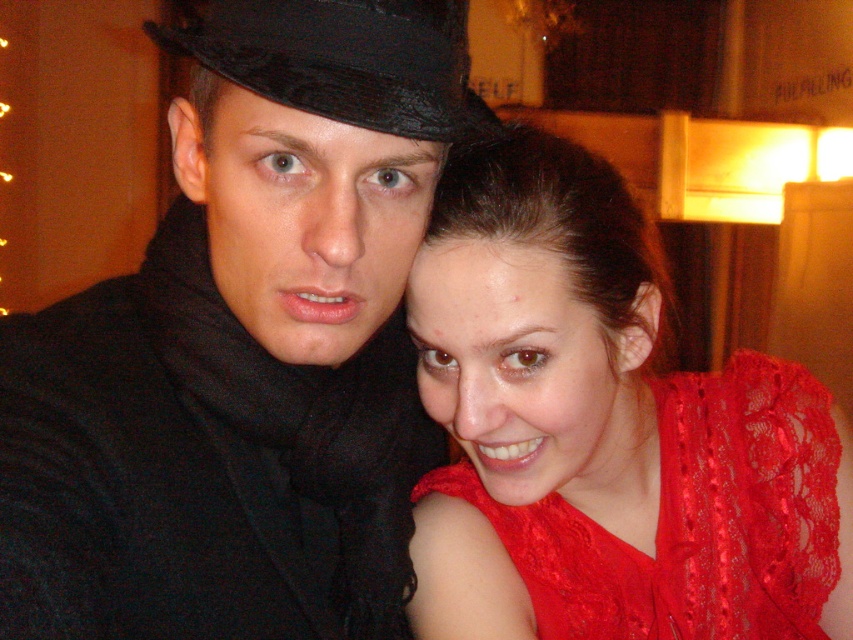
Question: Observing the image, what is the correct spatial positioning of matte black hat at upper center in reference to black satin fedora at upper left?

Choices:
 (A) below
 (B) above

Answer: (A)

Question: Can you confirm if lace fabric dress at upper right is smaller than black satin fedora at upper left?

Choices:
 (A) no
 (B) yes

Answer: (A)

Question: Is matte black hat at upper center wider than lace fabric dress at upper right?

Choices:
 (A) no
 (B) yes

Answer: (A)

Question: Which point is farther to the camera?

Choices:
 (A) black satin fedora at upper left
 (B) matte black hat at upper center
 (C) lace fabric dress at upper right

Answer: (C)

Question: Among these points, which one is farthest from the camera?

Choices:
 (A) (344, 56)
 (B) (334, 509)
 (C) (566, 298)

Answer: (B)

Question: Which point is farther to the camera?

Choices:
 (A) matte black hat at upper center
 (B) black satin fedora at upper left
 (C) lace fabric dress at upper right

Answer: (C)